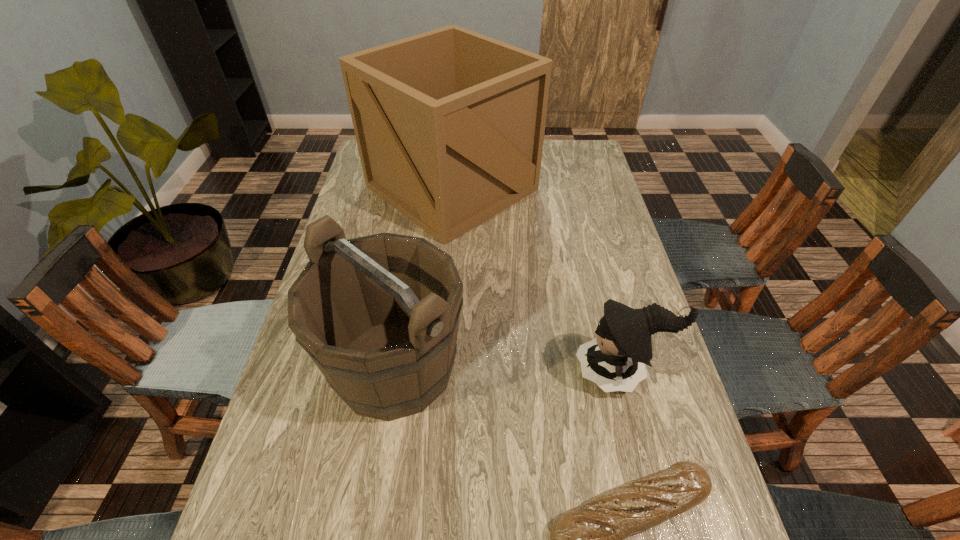
At what (x,y) coordinates should I click in order to perform the action: click on box that is positioned at the left edge. Please return your answer as a coordinate pair (x, y). Looking at the image, I should click on (449, 124).

You are a GUI agent. You are given a task and a screenshot of the screen. Output one action in this format:
    pyautogui.click(x=<x>, y=<y>)
    Task: Click on the bucket at the left edge
    This screenshot has height=540, width=960.
    Given the screenshot: What is the action you would take?
    pyautogui.click(x=379, y=315)

Identify the location of object at the right edge. (614, 360).

At what (x,y) coordinates should I click in order to perform the action: click on object situated at the far left corner. Please return your answer as a coordinate pair (x, y). Looking at the image, I should click on (449, 124).

The height and width of the screenshot is (540, 960). In the image, there is a desktop. In order to click on vacant space at the left edge in this screenshot , I will do click(267, 503).

In the image, there is a desktop. Where is `free region at the right edge`? The image size is (960, 540). free region at the right edge is located at coordinates (620, 291).

Locate an element on the screen. free space between the second shortest object and the box is located at coordinates (537, 279).

Find the location of `vacant point located between the third tallest object and the second tallest object`. vacant point located between the third tallest object and the second tallest object is located at coordinates coord(508,368).

This screenshot has width=960, height=540. I want to click on free space between the doll and the farthest object, so click(537, 279).

Where is `empty space that is in between the box and the third tallest object`? This screenshot has height=540, width=960. empty space that is in between the box and the third tallest object is located at coordinates (537, 279).